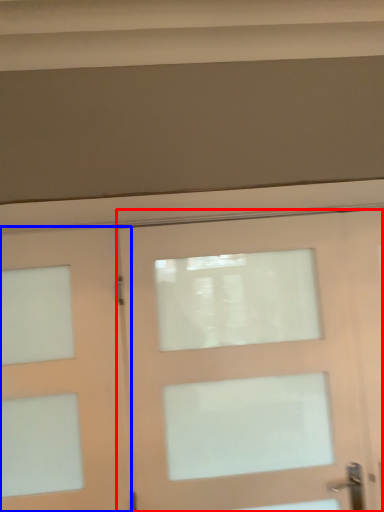
Question: Among these objects, which one is nearest to the camera, door (highlighted by a red box) or door (highlighted by a blue box)?

Choices:
 (A) door
 (B) door

Answer: (A)